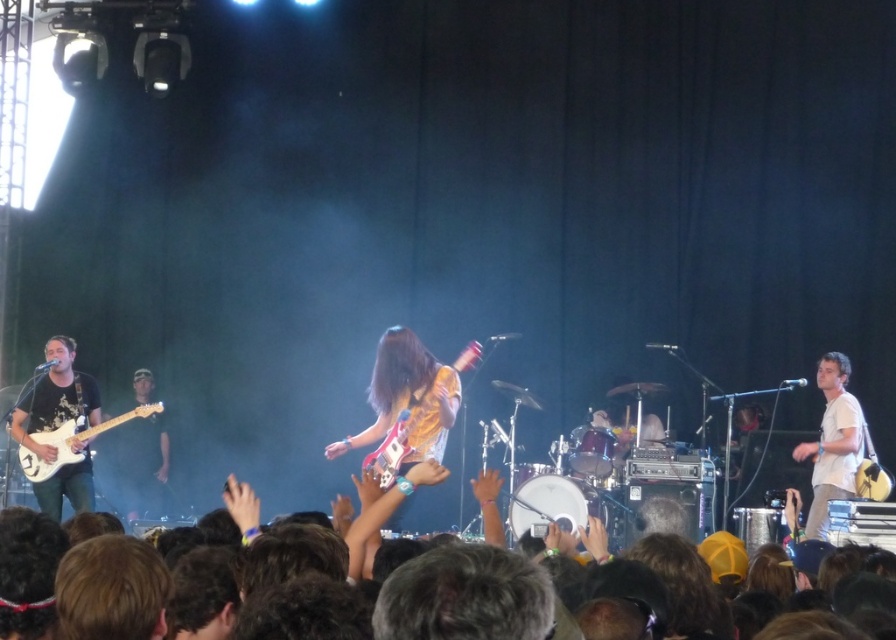
You are a stagehand who needs to place a new microphone stand between the yellow fabric guitar at center and the matte black guitar at left. Given that the microphone stand requires 1 meter of space, can you fit it between them based on their sizes?

The yellow fabric guitar at center is shorter than the matte black guitar at left. However, the description only provides information about their heights, not the distance between them. Therefore, it is impossible to determine if the microphone stand can fit based on the given details.

You are a stagehand who needs to transport both the yellow fabric guitar at center and the matte black guitar at left. Which guitar requires a wider storage space?

The yellow fabric guitar at center requires a wider storage space because its width surpasses that of the matte black guitar at left.